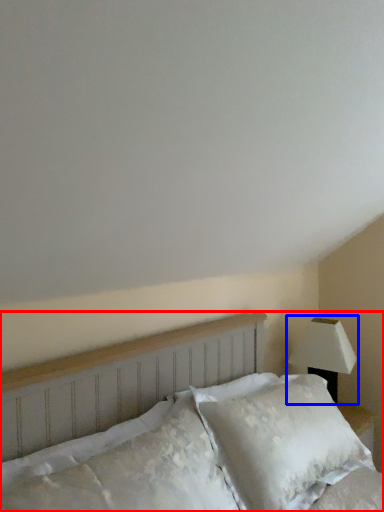
Question: Which object appears closest to the camera in this image, bed (highlighted by a red box) or lamp (highlighted by a blue box)?

Choices:
 (A) bed
 (B) lamp

Answer: (A)